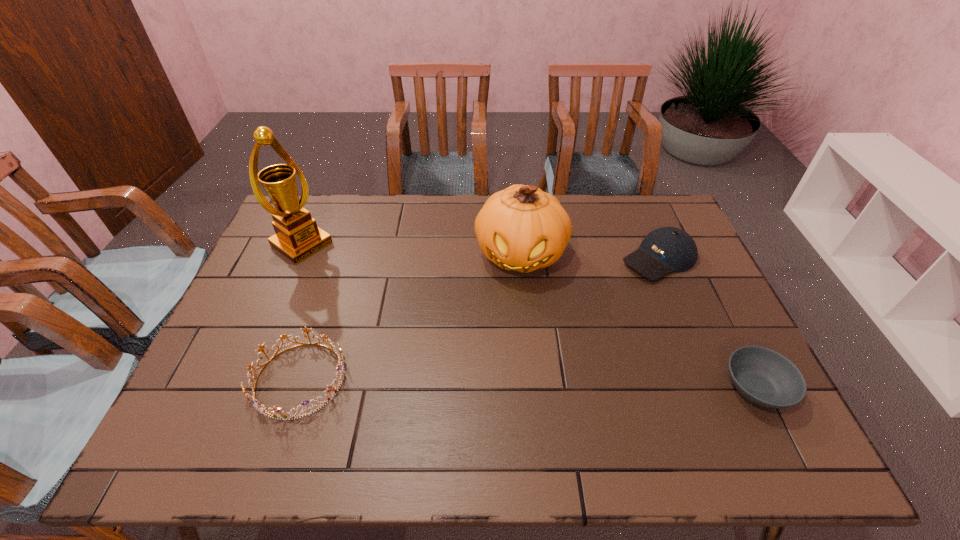
Image resolution: width=960 pixels, height=540 pixels. Identify the location of vacant space located on the front face of the second tallest object. (500, 409).

You are a GUI agent. You are given a task and a screenshot of the screen. Output one action in this format:
    pyautogui.click(x=<x>, y=<y>)
    Task: Click on the blank space located on the front face of the second tallest object
    This screenshot has height=540, width=960.
    Given the screenshot: What is the action you would take?
    pyautogui.click(x=503, y=387)

Image resolution: width=960 pixels, height=540 pixels. Find the location of `free space located on the front face of the second tallest object`. free space located on the front face of the second tallest object is located at coordinates (501, 401).

Find the location of a particular element. vacant space located on the front-facing side of the baseball cap is located at coordinates tap(559, 319).

Identify the location of vacant region located on the front-facing side of the baseball cap. This screenshot has width=960, height=540. (617, 283).

Where is `blank space located 0.150m on the front-facing side of the baseball cap`? blank space located 0.150m on the front-facing side of the baseball cap is located at coordinates (598, 294).

Image resolution: width=960 pixels, height=540 pixels. In order to click on award that is positioned at the far edge in this screenshot , I will do `click(297, 237)`.

Image resolution: width=960 pixels, height=540 pixels. I want to click on pumpkin present at the far edge, so click(521, 228).

Image resolution: width=960 pixels, height=540 pixels. Identify the location of baseball cap that is at the far edge. (667, 249).

In order to click on tiara that is at the near edge in this screenshot , I will do `click(275, 412)`.